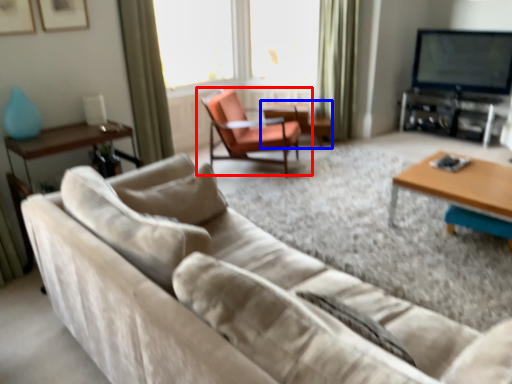
Question: Which of the following is the closest to the observer, chair (highlighted by a red box) or side table (highlighted by a blue box)?

Choices:
 (A) chair
 (B) side table

Answer: (A)